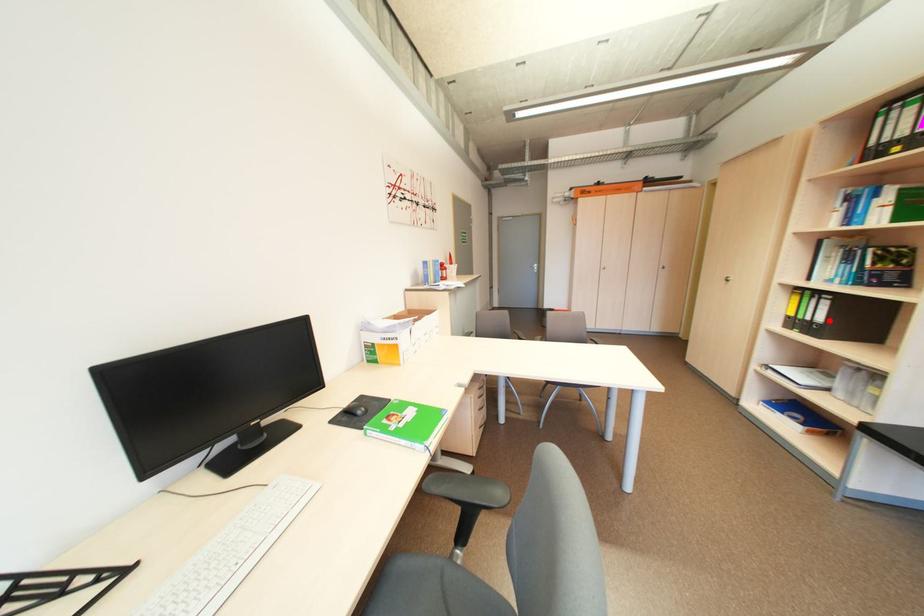
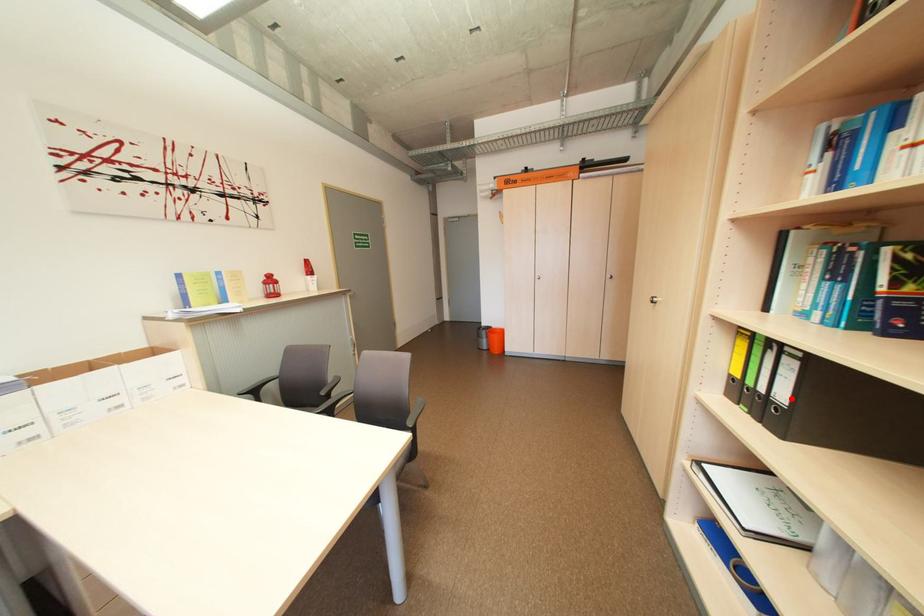
I am providing you with two images of the same scene from different viewpoints. A red point is marked on the first image and another point is marked on the second image. Does the point marked in image1 correspond to the same location as the one in image2?

Yes